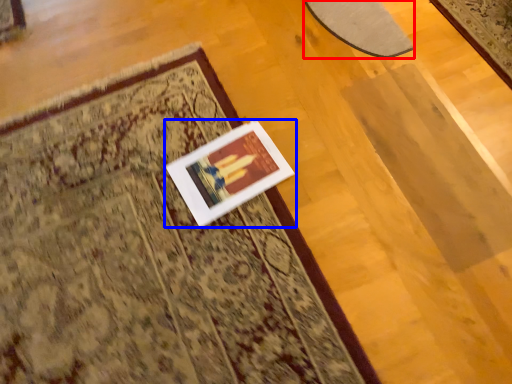
Question: Which object is closer to the camera taking this photo, mat (highlighted by a red box) or picture frame (highlighted by a blue box)?

Choices:
 (A) mat
 (B) picture frame

Answer: (B)